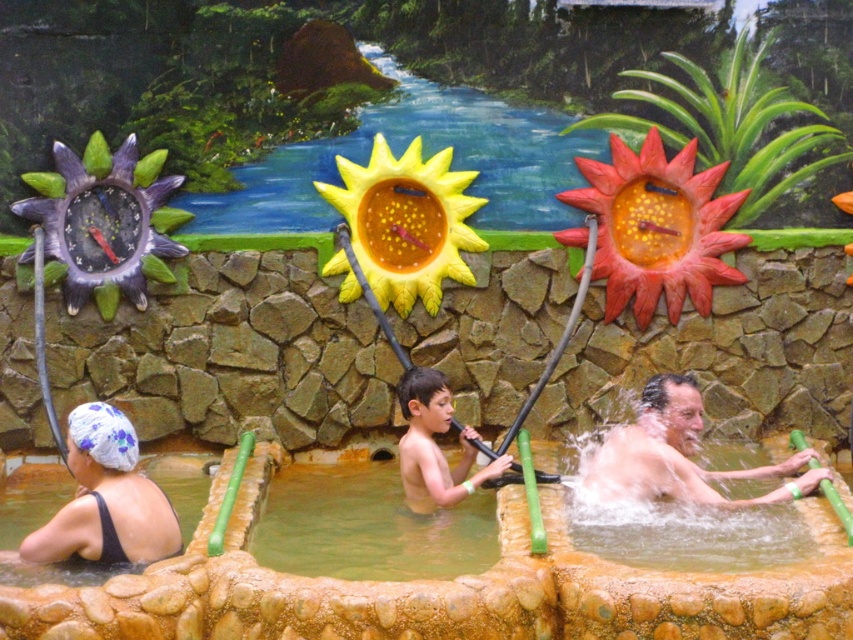
Question: Considering the real-world distances, which object is closest to the blue printed fabric at lower left?

Choices:
 (A) smooth stone hot tub at center
 (B) smooth green pole at lower right

Answer: (A)

Question: Which object appears farthest from the camera in this image?

Choices:
 (A) smooth stone hot tub at center
 (B) light brown skin at center
 (C) yellow painted sun at upper center
 (D) smooth green pole at lower right

Answer: (C)

Question: Which of the following is the farthest from the observer?

Choices:
 (A) light brown skin at center
 (B) blue printed fabric at lower left
 (C) smooth green pole at lower right

Answer: (C)

Question: Does yellow painted sun at upper center appear over smooth green pole at lower right?

Choices:
 (A) yes
 (B) no

Answer: (A)

Question: Is blue printed fabric at lower left wider than smooth green pole at lower right?

Choices:
 (A) no
 (B) yes

Answer: (A)

Question: Is yellow painted sun at upper center bigger than light brown skin at center?

Choices:
 (A) no
 (B) yes

Answer: (B)